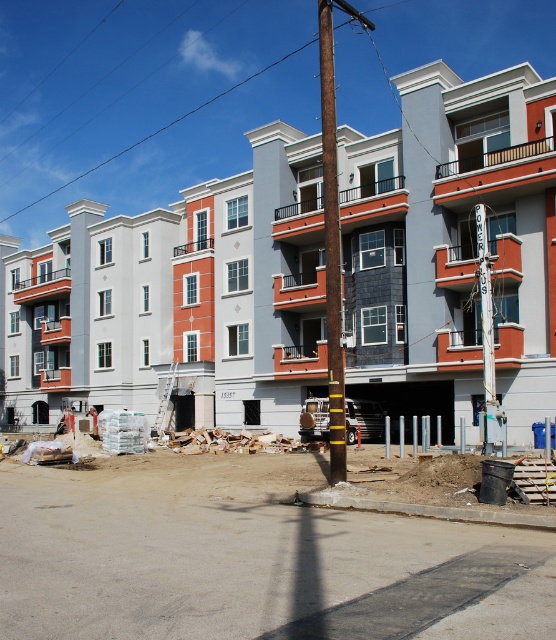
You are standing at the point marked as point (246, 557) in the image. What is the surface you are currently standing on?

The surface you are standing on is dirt at lower center, as the point (246, 557) is located there according to the description.

You are a construction worker standing at the base of the rusty metal pole at center. You need to reach the white concrete building at upper center to continue your work. Which direction should you move to get closer to the building?

You should move forward towards the white concrete building at upper center since it is closer to you than the rusty metal pole at center.